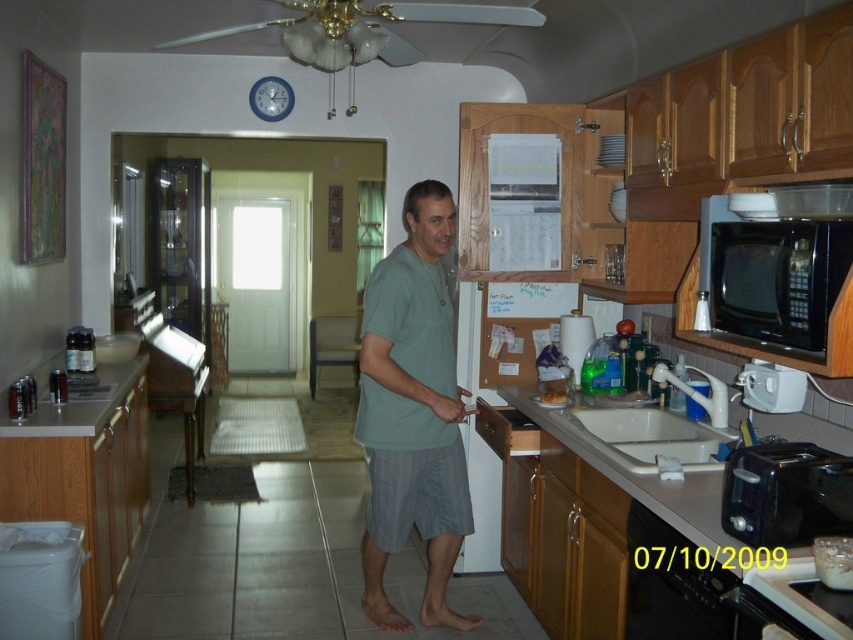
Question: Which point appears farthest from the camera in this image?

Choices:
 (A) (641, 420)
 (B) (764, 333)
 (C) (115, 404)

Answer: (C)

Question: Observing the image, what is the correct spatial positioning of white matte counter top at lower right in reference to white glossy sink at center?

Choices:
 (A) left
 (B) right

Answer: (B)

Question: Is black plastic toaster at lower right in front of white glossy sink at center?

Choices:
 (A) no
 (B) yes

Answer: (B)

Question: Estimate the real-world distances between objects in this image. Which object is farther from the black matte microwave at upper right?

Choices:
 (A) black plastic toaster at lower right
 (B) white glossy counter top at lower left
 (C) white plastic exhaust hood at upper center
 (D) gray cotton t-shirt at center

Answer: (B)

Question: Estimate the real-world distances between objects in this image. Which object is closer to the white plastic exhaust hood at upper center?

Choices:
 (A) white glossy counter top at lower left
 (B) white glossy sink at center

Answer: (B)

Question: Is black matte microwave at upper right thinner than white plastic exhaust hood at upper center?

Choices:
 (A) no
 (B) yes

Answer: (B)